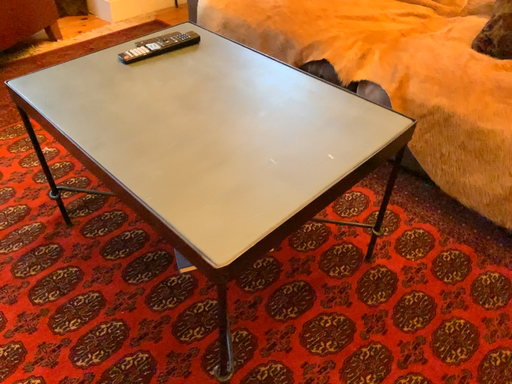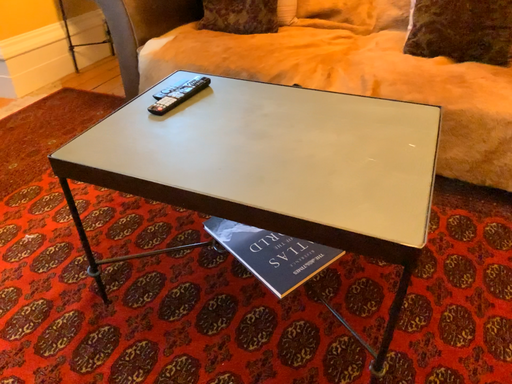
Question: Which way did the camera rotate in the video?

Choices:
 (A) rotated upward
 (B) rotated downward

Answer: (A)